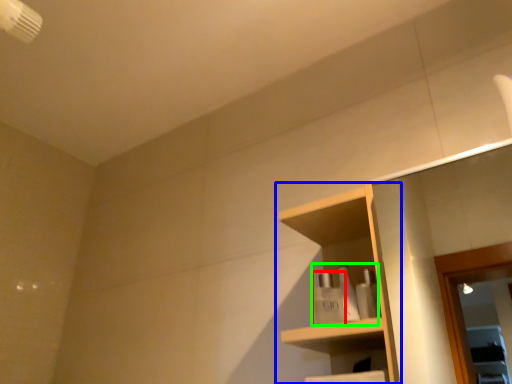
Question: Which object is positioned closest to toiletry (highlighted by a red box)? Select from shelf (highlighted by a blue box) and toiletry (highlighted by a green box).

Choices:
 (A) shelf
 (B) toiletry

Answer: (B)